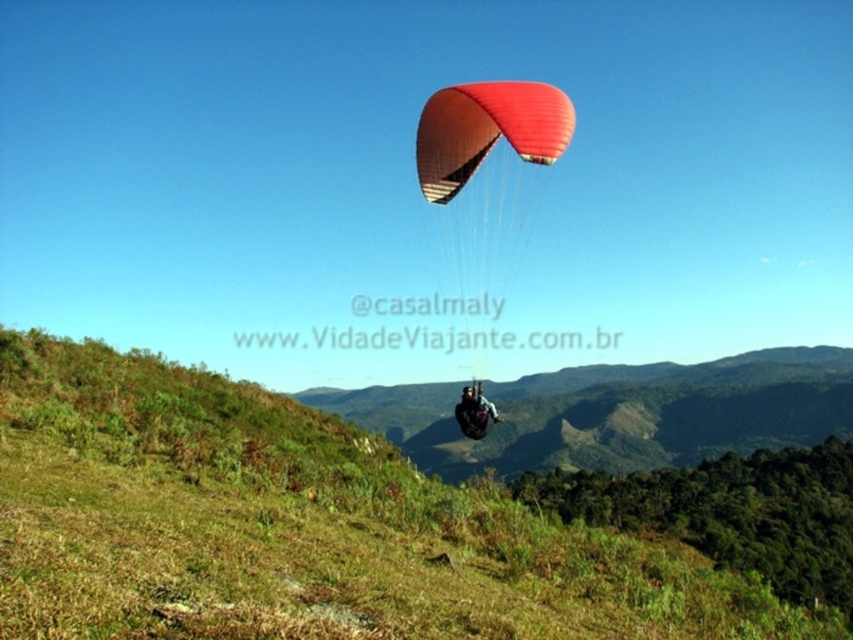
Does green grassy hillside at lower left have a lesser height compared to matte black helmet at center?

In fact, green grassy hillside at lower left may be taller than matte black helmet at center.

Does point (273, 493) lie behind point (476, 394)?

No, it is in front of (476, 394).

Is point (178, 467) in front of point (480, 403)?

Yes.

The width and height of the screenshot is (853, 640). Identify the location of green grassy hillside at lower left. (300, 528).

Can you confirm if matte red parachute at center is bigger than matte black helmet at center?

No.

At what (x,y) coordinates should I click in order to perform the action: click on matte red parachute at center. Please return your answer as a coordinate pair (x, y). Looking at the image, I should click on (486, 131).

At what (x,y) coordinates should I click in order to perform the action: click on green grassy hillside at lower left. Please return your answer as a coordinate pair (x, y). This screenshot has width=853, height=640. Looking at the image, I should click on (300, 528).

Who is more forward, (305,630) or (430,122)?

Point (305,630) is in front.

Where is `green grassy hillside at lower left`? green grassy hillside at lower left is located at coordinates (300, 528).